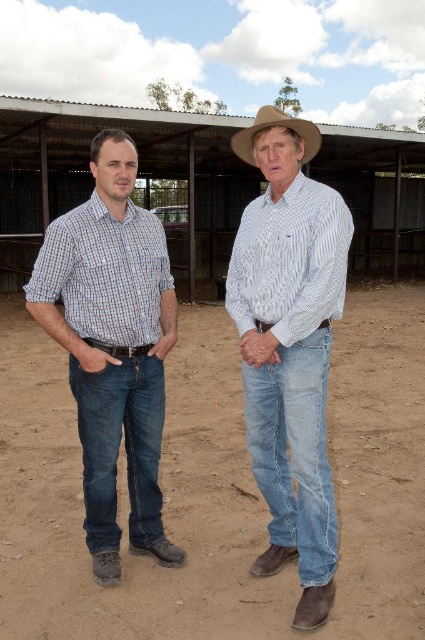
Question: Which object appears farthest from the camera in this image?

Choices:
 (A) checkered shirt at center
 (B) brown leather cowboy hat at center

Answer: (B)

Question: Estimate the real-world distances between objects in this image. Which object is closer to the white checkered shirt at center?

Choices:
 (A) white striped shirt at center
 (B) matte plaid shirt at left
 (C) brown leather cowboy hat at center

Answer: (A)

Question: Considering the real-world distances, which object is closest to the light blue denim jeans at center?

Choices:
 (A) white striped shirt at center
 (B) brown leather cowboy hat at center
 (C) checkered fabric shirt at left

Answer: (A)

Question: Does white checkered shirt at center appear under denim jeans at lower left?

Choices:
 (A) no
 (B) yes

Answer: (A)

Question: Does checkered fabric shirt at left have a lesser width compared to denim jeans at lower left?

Choices:
 (A) no
 (B) yes

Answer: (A)

Question: Is light blue denim jeans at center smaller than denim jeans at lower left?

Choices:
 (A) yes
 (B) no

Answer: (A)